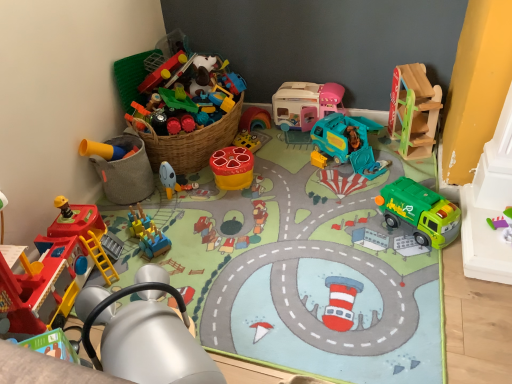
Where is `free space between matte plastic toy at center, the 7th toy viewed from the right, and blue plastic train at center, acting as the 8th toy starting from the right`? The image size is (512, 384). free space between matte plastic toy at center, the 7th toy viewed from the right, and blue plastic train at center, acting as the 8th toy starting from the right is located at coordinates (173, 213).